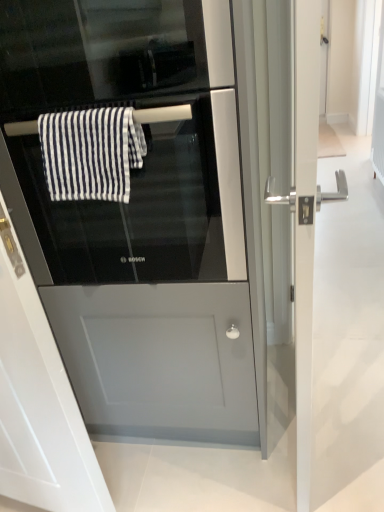
Find the location of a particular element. The image size is (384, 512). free space between silver metallic door handle at right, positioned as the 1th screen door in right-to-left order, and satin silver fridge at center is located at coordinates (216, 475).